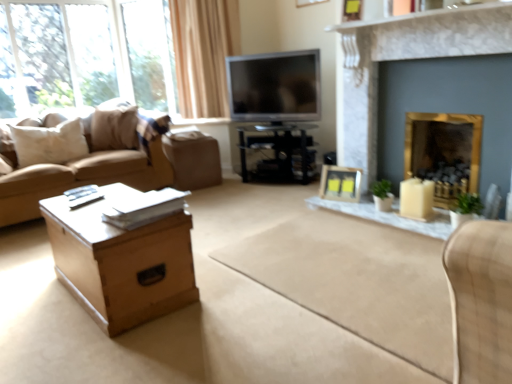
What do you see at coordinates (121, 264) in the screenshot?
I see `light brown wooden table at lower left, which is the second table from top to bottom` at bounding box center [121, 264].

Find the location of a particular element. white marble glass table at center is located at coordinates (390, 216).

This screenshot has width=512, height=384. Identify the location of black glossy tv stand at center, the 2th table when ordered from front to back. (278, 151).

The height and width of the screenshot is (384, 512). What do you see at coordinates (278, 151) in the screenshot?
I see `black glossy tv stand at center, the 2th table in the bottom-to-top sequence` at bounding box center [278, 151].

Image resolution: width=512 pixels, height=384 pixels. What do you see at coordinates (275, 86) in the screenshot?
I see `silver metallic television at upper center` at bounding box center [275, 86].

What do you see at coordinates (416, 16) in the screenshot? The image size is (512, 384). I see `white marble fireplace at upper center` at bounding box center [416, 16].

Image resolution: width=512 pixels, height=384 pixels. In order to click on light brown wooden table at lower left, marked as the 2th table in a right-to-left arrangement in this screenshot , I will do `click(121, 264)`.

Is gold metallic fireplace at right, the second fireplace in the front-to-back sequence, far away from white matte candle holder at right?

That's not correct — gold metallic fireplace at right, the second fireplace in the front-to-back sequence, is a little close to white matte candle holder at right.

From the image's perspective, who appears lower, gold metallic fireplace at right, which is the 1th fireplace in back-to-front order, or white matte candle holder at right?

white matte candle holder at right.

From the picture: From a real-world perspective, is gold metallic fireplace at right, which is the 1th fireplace in back-to-front order, physically above white matte candle holder at right?

Correct, in the physical world, gold metallic fireplace at right, which is the 1th fireplace in back-to-front order, is higher than white matte candle holder at right.

Between point (479, 163) and point (432, 198), which one is positioned in front?

The point (479, 163) is in front.

In order to click on armchair that is in front of the black glossy tv stand at center, the 1th table in the back-to-front sequence in this screenshot , I will do `click(492, 202)`.

Considering the relative sizes of black glossy tv stand at center, the 1th table in the back-to-front sequence, and white fabric armchair at right in the image provided, is black glossy tv stand at center, the 1th table in the back-to-front sequence, bigger than white fabric armchair at right?

Indeed, black glossy tv stand at center, the 1th table in the back-to-front sequence, has a larger size compared to white fabric armchair at right.

Would you say black glossy tv stand at center, the 1th table in the back-to-front sequence, is inside or outside white fabric armchair at right?

black glossy tv stand at center, the 1th table in the back-to-front sequence, is not enclosed by white fabric armchair at right.

Does gold marble fireplace at upper right, the 2th fireplace when ordered from back to front, have a lesser height compared to white marble glass table at center?

In fact, gold marble fireplace at upper right, the 2th fireplace when ordered from back to front, may be taller than white marble glass table at center.

Is gold marble fireplace at upper right, which is counted as the 1th fireplace, starting from the front, smaller than white marble glass table at center?

Incorrect, gold marble fireplace at upper right, which is counted as the 1th fireplace, starting from the front, is not smaller in size than white marble glass table at center.

Is gold marble fireplace at upper right, which is counted as the 1th fireplace, starting from the front, with white marble glass table at center?

No, gold marble fireplace at upper right, which is counted as the 1th fireplace, starting from the front, is not making contact with white marble glass table at center.

Which object is further away from the camera taking this photo, white marble fireplace at upper center or gold marble fireplace at upper right, which is counted as the 1th fireplace, starting from the front?

Positioned behind is gold marble fireplace at upper right, which is counted as the 1th fireplace, starting from the front.

Is white marble fireplace at upper center not near gold marble fireplace at upper right, the 2th fireplace when ordered from back to front?

Actually, white marble fireplace at upper center and gold marble fireplace at upper right, the 2th fireplace when ordered from back to front, are a little close together.

Which is behind, point (467, 11) or point (372, 29)?

The point (372, 29) is farther.

Is white fabric armchair at right to the right of matte yellow picture frame at center, the 2th picture frame from the front, from the viewer's perspective?

Yes, white fabric armchair at right is to the right of matte yellow picture frame at center, the 2th picture frame from the front.

How different are the orientations of white fabric armchair at right and matte yellow picture frame at center, which is the 1th picture frame in back-to-front order, in degrees?

13.8 degrees.

From the image's perspective, which is above, white fabric armchair at right or matte yellow picture frame at center, which is the 1th picture frame in back-to-front order?

matte yellow picture frame at center, which is the 1th picture frame in back-to-front order, appears higher in the image.

From a real-world perspective, between white fabric armchair at right and matte yellow picture frame at center, which is the 1th picture frame in back-to-front order, who is vertically higher?

From a 3D spatial view, white fabric armchair at right is above.

Where is `pillow below the gold marble fireplace at upper right, the 2th fireplace when ordered from back to front (from a real-world perspective)`? This screenshot has width=512, height=384. pillow below the gold marble fireplace at upper right, the 2th fireplace when ordered from back to front (from a real-world perspective) is located at coordinates pos(49,143).

Is gold marble fireplace at upper right, which is counted as the 1th fireplace, starting from the front, next to white soft pillow at left and touching it?

No, gold marble fireplace at upper right, which is counted as the 1th fireplace, starting from the front, is not in contact with white soft pillow at left.

Which of these two, gold marble fireplace at upper right, the 2th fireplace when ordered from back to front, or white soft pillow at left, stands shorter?

white soft pillow at left.

From a real-world perspective, is gold marble fireplace at upper right, which is counted as the 1th fireplace, starting from the front, located beneath white matte candle holder at right?

No, from a real-world perspective, gold marble fireplace at upper right, which is counted as the 1th fireplace, starting from the front, is not under white matte candle holder at right.

Based on their positions, is gold marble fireplace at upper right, the 2th fireplace when ordered from back to front, located to the left or right of white matte candle holder at right?

Based on their positions, gold marble fireplace at upper right, the 2th fireplace when ordered from back to front, is located to the right of white matte candle holder at right.

From the image's perspective, between gold marble fireplace at upper right, the 2th fireplace when ordered from back to front, and white matte candle holder at right, which one is located above?

gold marble fireplace at upper right, the 2th fireplace when ordered from back to front, is shown above in the image.

Is gold marble fireplace at upper right, the 2th fireplace when ordered from back to front, next to white matte candle holder at right?

No.

This screenshot has width=512, height=384. Find the location of `candle holder that is below the gold metallic fireplace at right, which is the 1th fireplace in back-to-front order (from the image's perspective)`. candle holder that is below the gold metallic fireplace at right, which is the 1th fireplace in back-to-front order (from the image's perspective) is located at coordinates (417, 199).

From a real-world perspective, which table is the 2nd one above the white fabric armchair at right? Please provide its 2D coordinates.

[(278, 151)]

When comparing their distances from black glossy tv stand at center, acting as the 2th table starting from the left, does light brown wooden table at lower left, marked as the first table in a front-to-back arrangement, or wooden picture frame at upper center, arranged as the 1th picture frame when viewed from the top, seem further?

The object further to black glossy tv stand at center, acting as the 2th table starting from the left, is light brown wooden table at lower left, marked as the first table in a front-to-back arrangement.

Estimate the real-world distances between objects in this image. Which object is closer to light brown wooden table at lower left, which is the first table in left-to-right order, black glossy tv stand at center, the 1th table from the top, or wooden picture frame at upper center, the 2th picture frame when ordered from back to front?

The object closer to light brown wooden table at lower left, which is the first table in left-to-right order, is black glossy tv stand at center, the 1th table from the top.

Estimate the real-world distances between objects in this image. Which object is further from light brown wooden table at lower left, which is the second table from top to bottom, matte yellow picture frame at center, which is the 1th picture frame in back-to-front order, or white soft pillow at left?

Based on the image, white soft pillow at left appears to be further to light brown wooden table at lower left, which is the second table from top to bottom.

From the image, which object appears to be farther from wooden picture frame at upper center, which appears as the 1th picture frame when viewed from the front, silver metallic television at upper center or white matte candle holder at right?

white matte candle holder at right is positioned further to the anchor wooden picture frame at upper center, which appears as the 1th picture frame when viewed from the front.

Based on their spatial positions, is white marble glass table at center or wooden picture frame at upper center, arranged as the 1th picture frame when viewed from the top, closer to white marble fireplace at upper center?

The object closer to white marble fireplace at upper center is wooden picture frame at upper center, arranged as the 1th picture frame when viewed from the top.

Based on their spatial positions, is white matte candle holder at right or silver metallic television at upper center closer to brown leather footrest at center?

silver metallic television at upper center is closer to brown leather footrest at center.

Estimate the real-world distances between objects in this image. Which object is further from beige fabric couch at left, matte yellow picture frame at center, arranged as the 1th picture frame when ordered from the bottom, or white marble glass table at center?

white marble glass table at center.

From the image, which object appears to be nearer to white marble glass table at center, white soft pillow at left or black glossy tv stand at center, the 2th table when ordered from front to back?

The object closer to white marble glass table at center is black glossy tv stand at center, the 2th table when ordered from front to back.

The width and height of the screenshot is (512, 384). I want to click on picture frame that lies between wooden picture frame at upper center, the 2th picture frame when ordered from back to front, and white matte candle holder at right from top to bottom, so click(340, 183).

Locate an element on the screen. The height and width of the screenshot is (384, 512). television between light brown wooden table at lower left, marked as the first table in a front-to-back arrangement, and black glossy tv stand at center, the 1th table in the back-to-front sequence, from front to back is located at coordinates (275, 86).

The width and height of the screenshot is (512, 384). I want to click on television situated between beige fabric couch at left and wooden picture frame at upper center, arranged as the 1th picture frame when viewed from the top, from left to right, so click(x=275, y=86).

Locate an element on the screen. The width and height of the screenshot is (512, 384). candle holder between matte yellow picture frame at center, which is the 1th picture frame in back-to-front order, and gold metallic fireplace at right, the second fireplace in the front-to-back sequence, from left to right is located at coordinates (417, 199).